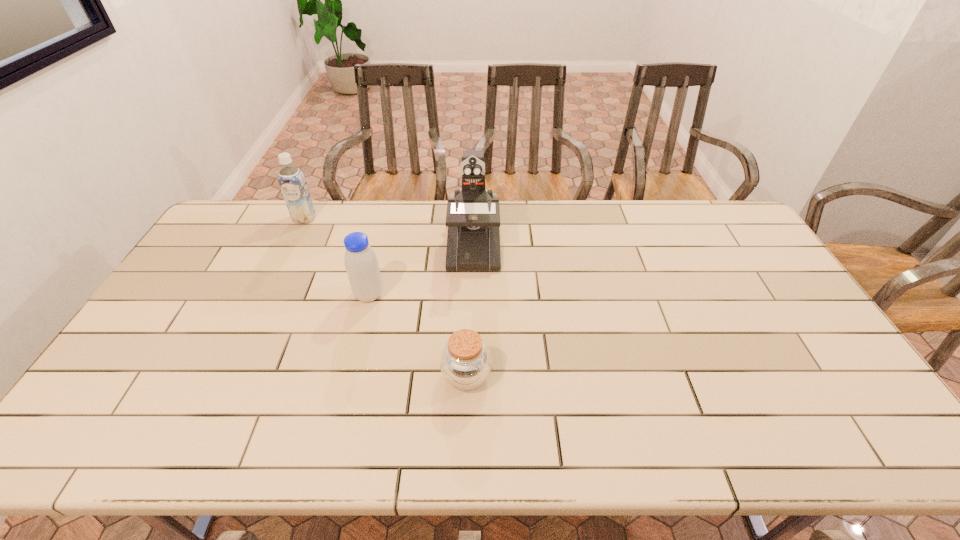
Locate an element on the screen. The height and width of the screenshot is (540, 960). vacant space in between the nearest object and the third farthest object is located at coordinates (418, 335).

This screenshot has height=540, width=960. Identify the location of vacant area between the microscope and the nearer soya milk. (420, 269).

Locate an element on the screen. unoccupied area between the jar and the leftmost object is located at coordinates (385, 297).

At what (x,y) coordinates should I click in order to perform the action: click on free space between the microscope and the second object from left to right. Please return your answer as a coordinate pair (x, y). The height and width of the screenshot is (540, 960). Looking at the image, I should click on (420, 269).

Locate an element on the screen. The image size is (960, 540). free spot between the second shortest object and the jar is located at coordinates (418, 335).

This screenshot has width=960, height=540. What are the coordinates of `vacant space that's between the shortest object and the farther soya milk` in the screenshot? It's located at (385, 297).

Where is `free spot between the nearer soya milk and the nearest object`? free spot between the nearer soya milk and the nearest object is located at coordinates (418, 335).

Point out which object is positioned as the third nearest to the shortest object. Please provide its 2D coordinates. Your answer should be formatted as a tuple, i.e. [(x, y)], where the tuple contains the x and y coordinates of a point satisfying the conditions above.

[(291, 179)]

Locate which object ranks third in proximity to the left soya milk. Please provide its 2D coordinates. Your answer should be formatted as a tuple, i.e. [(x, y)], where the tuple contains the x and y coordinates of a point satisfying the conditions above.

[(465, 362)]

Locate an element on the screen. This screenshot has width=960, height=540. free region that satisfies the following two spatial constraints: 1. on the label of the farther soya milk; 2. on the right side of the second object from left to right is located at coordinates (268, 295).